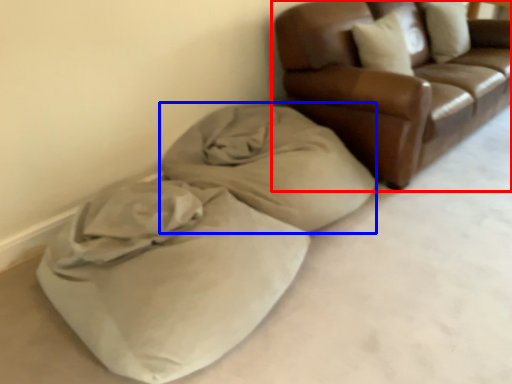
Question: Which point is closer to the camera, studio couch (highlighted by a red box) or blanket (highlighted by a blue box)?

Choices:
 (A) studio couch
 (B) blanket

Answer: (B)